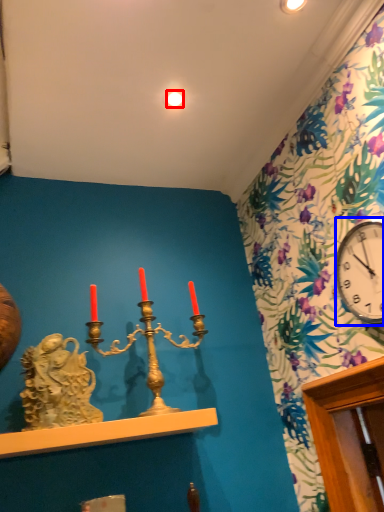
Question: Which of the following is the farthest to the observer, light (highlighted by a red box) or clock (highlighted by a blue box)?

Choices:
 (A) light
 (B) clock

Answer: (A)